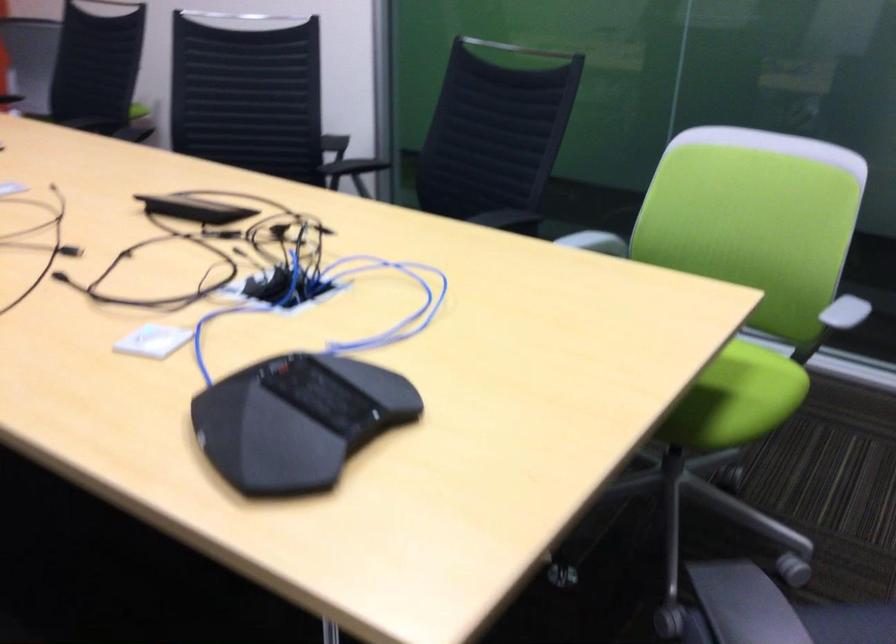
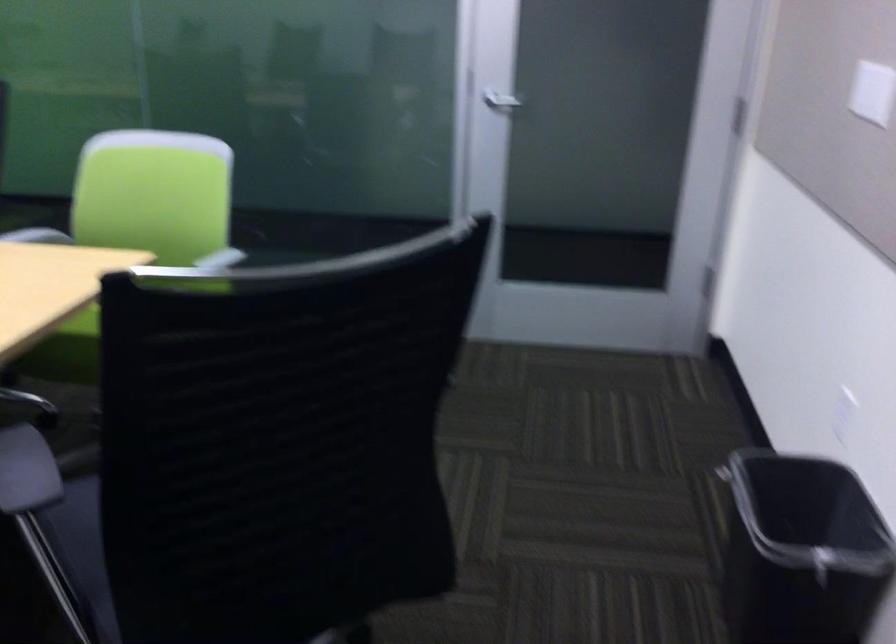
The images are taken continuously from a first-person perspective. In which direction are you moving?

The cameraman moved toward right, backward.